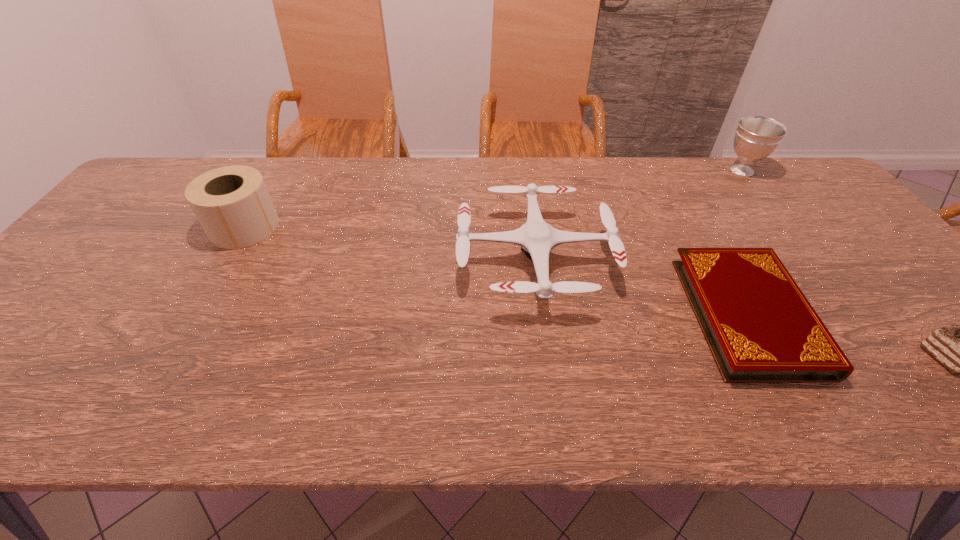
At what (x,y) coordinates should I click in order to perform the action: click on the fourth object from left to right. Please return your answer as a coordinate pair (x, y). This screenshot has height=540, width=960. Looking at the image, I should click on (756, 137).

Where is `the farthest object`? the farthest object is located at coordinates (756, 137).

What are the coordinates of `toilet tissue` in the screenshot? It's located at (232, 204).

Locate an element on the screen. This screenshot has width=960, height=540. drone is located at coordinates (536, 238).

Identify the location of the fourth object from right to left. This screenshot has height=540, width=960. (536, 238).

This screenshot has height=540, width=960. In order to click on hardback book in this screenshot , I will do `click(760, 328)`.

The image size is (960, 540). I want to click on the third object from right to left, so click(760, 328).

Identify the location of free spot located 0.370m on the left of the chalice. (607, 171).

I want to click on free space located 0.100m on the right of the toilet tissue, so click(314, 227).

At what (x,y) coordinates should I click in order to perform the action: click on free region located with the camera attached at the bottom of the fourth object from right to left. Please return your answer as a coordinate pair (x, y). Looking at the image, I should click on (419, 259).